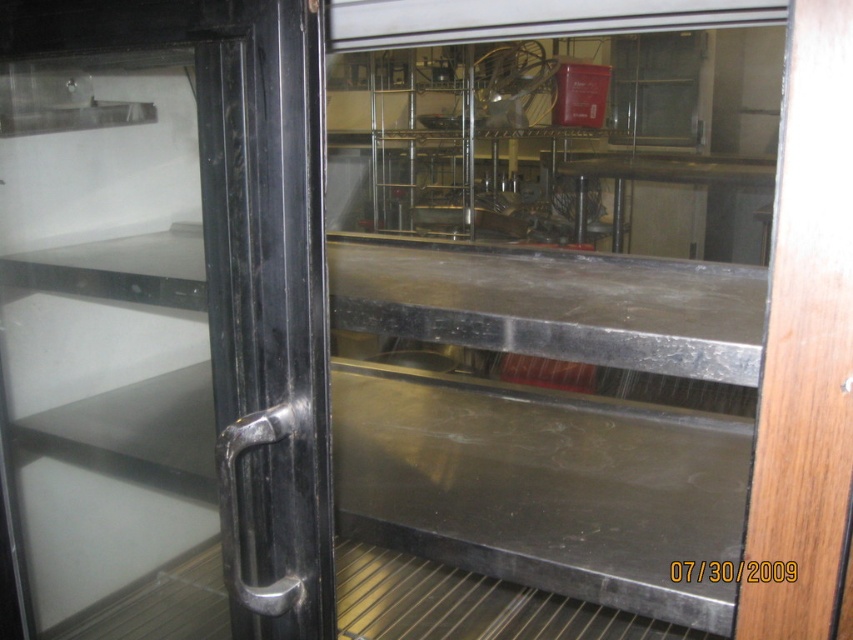
Looking at this image, you are a chef entering the kitchen and need to open the transparent glass door at center. To do so, you must first locate the black metallic handle at left. Based on their positions, which object is closer to you?

The transparent glass door at center is closer to you than the black metallic handle at left, so you can reach the transparent glass door at center first.

You are a delivery person entering the commercial kitchen and see the point at coordinates (546, 316). What object is located at that point?

The point at coordinates (546, 316) corresponds to the transparent glass door at center.

You are a chef trying to reach the black metallic handle at left on the transparent glass door at center. Considering their sizes, do you think you can easily grab the handle without adjusting your grip?

The transparent glass door at center has a lesser height compared to black metallic handle at left, meaning the handle is taller. Since the handle is taller, it should be easier to grab without needing to adjust your grip.